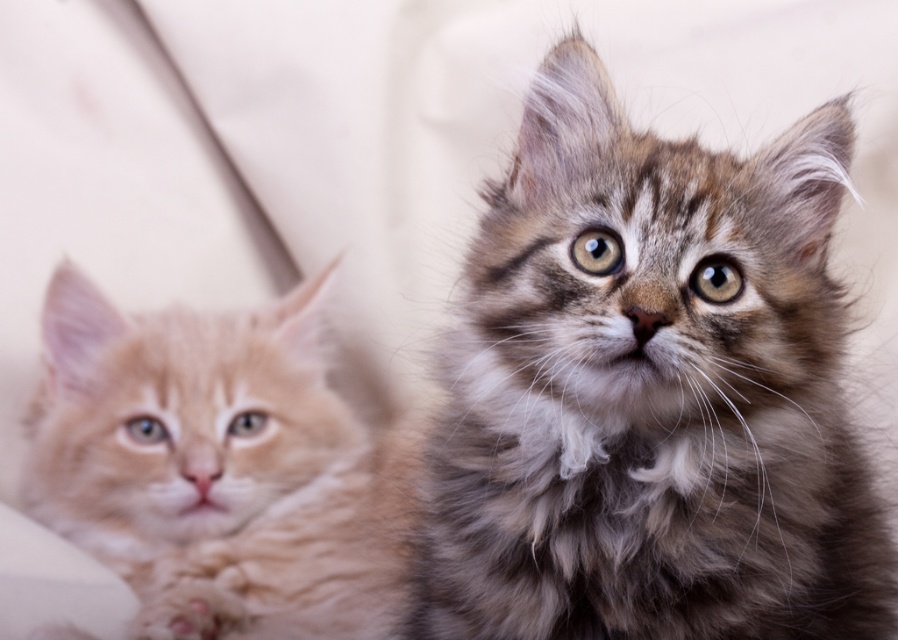
You are a photographer trying to capture a clear photo of both kittens. Since the orange tabby kitten at left is slightly out of focus, where should you adjust your camera focus to ensure both the fuzzy gray tabby kitten at center and the orange tabty kitten at left are in focus?

To ensure both the fuzzy gray tabby kitten at center and the orange tabby kitten at left are in focus, you should focus on the fuzzy gray tabby kitten at center since it is located above the orange tabby kitten at left, and adjusting focus to the closer subject will increase the depth of field, bringing both into clarity.

You are a photographer trying to capture both the fuzzy gray tabby kitten at center and the orange tabby kitten at left in a single shot. Given that the camera can only focus on one kitten clearly at a time, which kitten should you focus on to ensure the other remains somewhat in focus?

The fuzzy gray tabby kitten at center is smaller than the orange tabby kitten at left. To ensure the orange tabby kitten at left stays somewhat in focus, focus on the fuzzy gray tabby kitten at center since it is closer to the camera.

You are a photographer trying to capture both kittens in a single frame. Given their positions, which kitten should you adjust your camera focus to ensure the orange tabby kitten at left is in focus while keeping the fuzzy gray tabby kitten at center somewhat visible?

Since the fuzzy gray tabby kitten at center is to the right of the orange tabby kitten at left, you should focus on the orange tabby kitten at left. This will ensure it is in focus while the fuzzy gray tabby kitten at center remains somewhat visible in the frame.